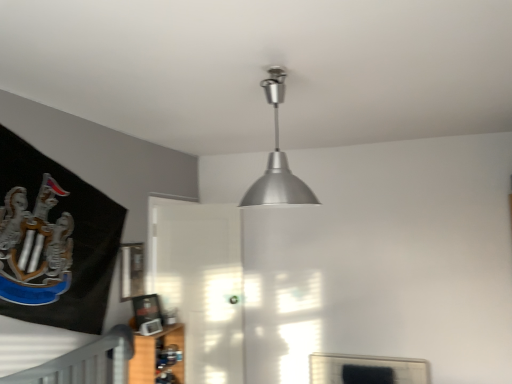
Question: From the image's perspective, is silver metallic lampshade at upper center located above or below transparent glass door at center?

Choices:
 (A) below
 (B) above

Answer: (B)

Question: Looking at their shapes, would you say silver metallic lampshade at upper center is wider or thinner than transparent glass door at center?

Choices:
 (A) wide
 (B) thin

Answer: (B)

Question: Which is farther from the transparent glass door at center?

Choices:
 (A) silver metallic lampshade at upper center
 (B) metallic silver picture frame at upper center
 (C) wooden shelf at lower left

Answer: (A)

Question: Which of these objects is positioned farthest from the wooden shelf at lower left?

Choices:
 (A) silver metallic lampshade at upper center
 (B) metallic silver picture frame at upper center
 (C) transparent glass door at center

Answer: (A)